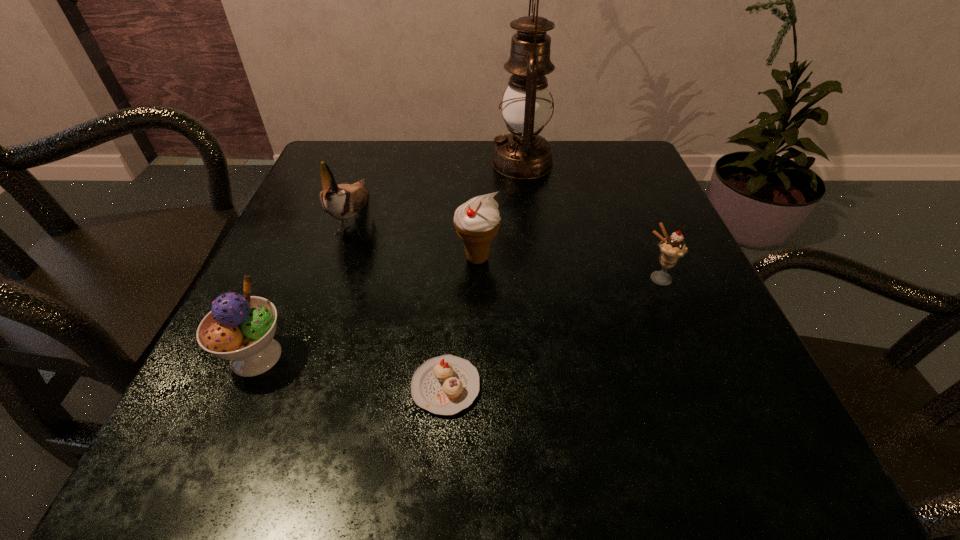
Locate an element on the screen. This screenshot has height=540, width=960. vacant area that lies between the rightmost object and the tallest object is located at coordinates (589, 221).

The width and height of the screenshot is (960, 540). Identify the location of free space between the oil lamp and the bird. (439, 190).

Find the location of `blank region between the leftmost icecream and the tallest icecream`. blank region between the leftmost icecream and the tallest icecream is located at coordinates (367, 307).

The width and height of the screenshot is (960, 540). What are the coordinates of `free area in between the second tallest object and the cupcake` in the screenshot? It's located at [x=400, y=302].

I want to click on free point between the oil lamp and the tallest icecream, so click(500, 211).

You are a GUI agent. You are given a task and a screenshot of the screen. Output one action in this format:
    pyautogui.click(x=<x>, y=<y>)
    Task: Click on the vacant area between the rightmost icecream and the shortest object
    Image resolution: width=960 pixels, height=540 pixels.
    Given the screenshot: What is the action you would take?
    click(551, 333)

Locate which object ranks fourth in proximity to the rightmost icecream. Please provide its 2D coordinates. Your answer should be formatted as a tuple, i.e. [(x, y)], where the tuple contains the x and y coordinates of a point satisfying the conditions above.

[(343, 201)]

Identify the location of the third closest object relative to the rightmost object. The image size is (960, 540). (444, 385).

Where is `icecream that is the closest to the bird`? The height and width of the screenshot is (540, 960). icecream that is the closest to the bird is located at coordinates (240, 328).

Choose which icecream is the second nearest neighbor to the rightmost icecream. Please provide its 2D coordinates. Your answer should be formatted as a tuple, i.e. [(x, y)], where the tuple contains the x and y coordinates of a point satisfying the conditions above.

[(240, 328)]